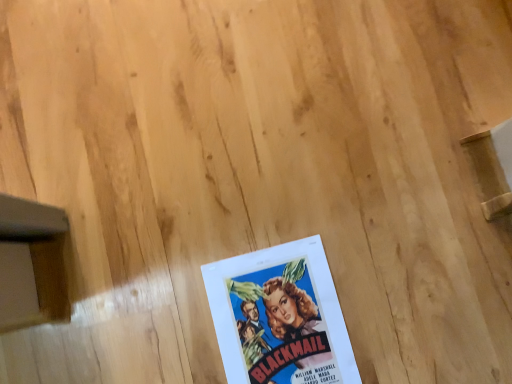
This screenshot has height=384, width=512. In order to click on empty space that is ontop of matte paper poster at center (from a real-world perspective) in this screenshot , I will do click(283, 327).